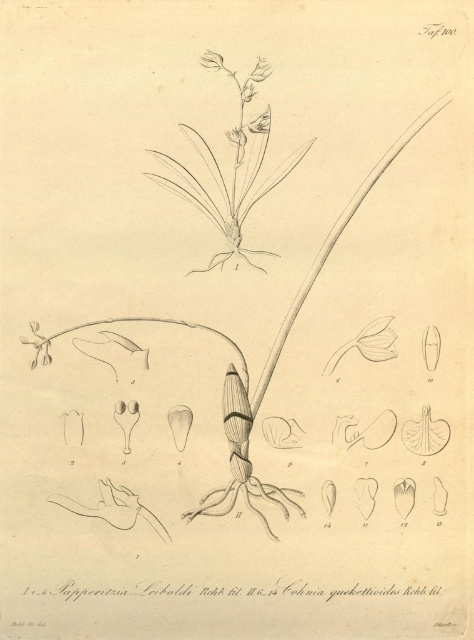
What do you see at coordinates (367, 342) in the screenshot? Image resolution: width=474 pixels, height=640 pixels. I see `matte white petal at center` at bounding box center [367, 342].

Is point (325, 371) farther from camera compared to point (270, 109)?

Yes, point (325, 371) is farther from viewer.

This screenshot has width=474, height=640. Identify the location of matte white petal at center. (367, 342).

Can you confirm if gray sketch orchid at center is taller than matte white flower at lower left?

Correct, gray sketch orchid at center is much taller as matte white flower at lower left.

How far apart are gray sketch orchid at center and matte white flower at lower left?

gray sketch orchid at center and matte white flower at lower left are 38.68 centimeters apart from each other.

This screenshot has width=474, height=640. What are the coordinates of `gray sketch orchid at center` in the screenshot? It's located at (233, 170).

Find the location of `gray sketch orchid at center`. gray sketch orchid at center is located at coordinates (233, 170).

Is point (381, 358) closer to viewer compared to point (42, 356)?

No.

Is matte white petal at center shorter than matte white flower at lower left?

No, matte white petal at center is not shorter than matte white flower at lower left.

Identify the location of matte white petal at center. (367, 342).